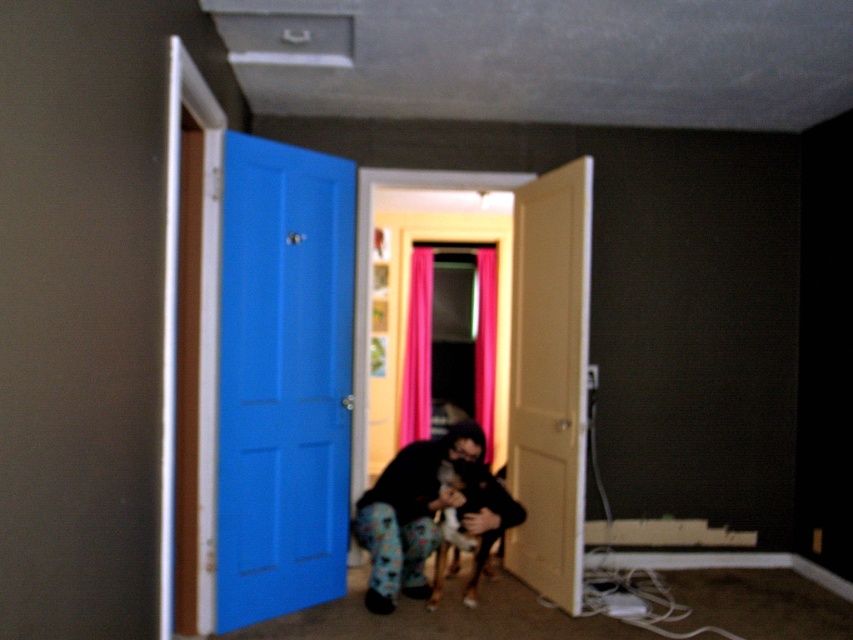
You are a delivery person trying to enter the room through the blue painted door at left. However, there is a fluffy brown dog at lower center blocking the entrance. Can you pass through the door without disturbing the dog?

The blue painted door at left is in front of the fluffy brown dog at lower center, meaning the dog is behind the door. Since the door is open, you can pass through without disturbing the dog by simply walking through the open door.

From the picture: You are a painter who needs to ensure there is enough space between the fluffy fur dog at center and the fluffy brown dog at lower center to set up an easel. Can you determine if the vertical space between them allows for an easel that is 1.2 meters tall?

The fluffy fur dog at center is much taller than the fluffy brown dog at lower center, but the exact vertical distance between them isn t specified. Without knowing the actual height difference or their positions, it s impossible to confirm if the space is sufficient for a 1.2 meter tall easel.